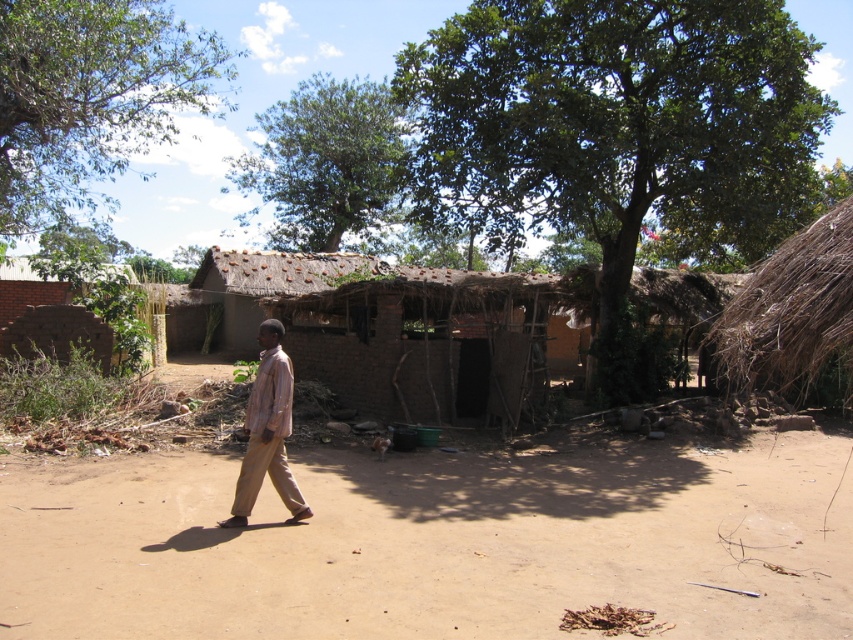
The width and height of the screenshot is (853, 640). What do you see at coordinates (432, 541) in the screenshot?
I see `brown dirt field at center` at bounding box center [432, 541].

Can you confirm if brown dirt field at center is wider than light brown fabric shirt at center?

Yes.

Between point (321, 596) and point (254, 454), which one is positioned behind?

The point (254, 454) is more distant.

Find the location of a particular element. Image resolution: width=853 pixels, height=640 pixels. brown dirt field at center is located at coordinates (432, 541).

Is green leafy tree at upper left above light brown fabric shirt at center?

Indeed, green leafy tree at upper left is positioned over light brown fabric shirt at center.

Where is `green leafy tree at upper left`? This screenshot has width=853, height=640. green leafy tree at upper left is located at coordinates (90, 97).

Can you confirm if brown dirt field at center is positioned below green leafy tree at upper center?

Correct, brown dirt field at center is located below green leafy tree at upper center.

Is brown dirt field at center taller than green leafy tree at upper center?

No.

Does point (660, 545) lie behind point (300, 209)?

No, it is not.

Identify the location of brown dirt field at center. (432, 541).